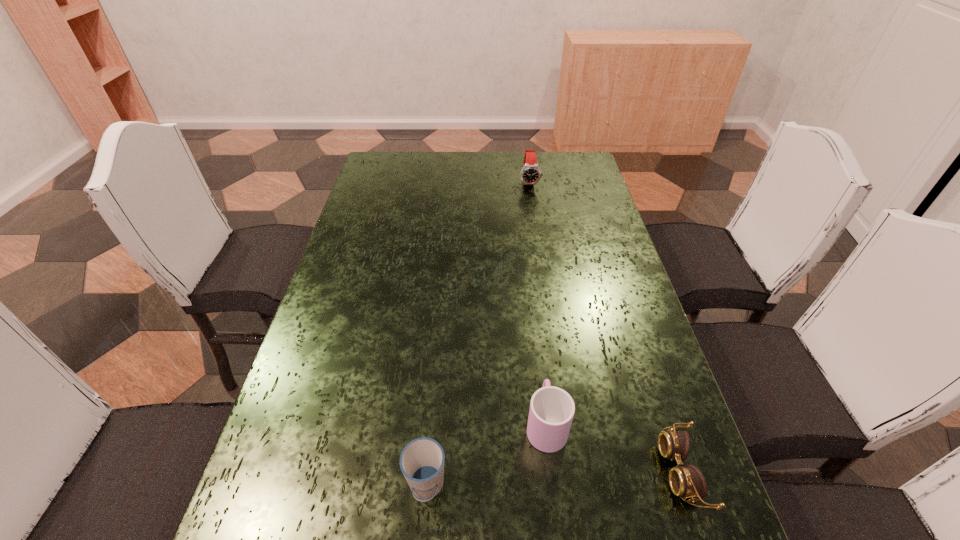
You are a GUI agent. You are given a task and a screenshot of the screen. Output one action in this format:
    pyautogui.click(x=<x>, y=<y>)
    Task: Click on the watch
    The image size is (960, 540).
    Given the screenshot: What is the action you would take?
    pyautogui.click(x=530, y=174)

I want to click on the farther cup, so point(552,409).

Find the location of a particular element. the left cup is located at coordinates (421, 461).

Image resolution: width=960 pixels, height=540 pixels. Find the location of `the leftmost object`. the leftmost object is located at coordinates (421, 461).

At what (x,y) coordinates should I click in order to perform the action: click on the rightmost object. Please return your answer as a coordinate pair (x, y). This screenshot has height=540, width=960. Looking at the image, I should click on (688, 481).

Find the location of a particular element. This screenshot has height=540, width=960. the shortest object is located at coordinates (688, 481).

Where is `vacant space located on the face of the watch`? The height and width of the screenshot is (540, 960). vacant space located on the face of the watch is located at coordinates (538, 237).

Find the location of a particular element. Image resolution: width=960 pixels, height=540 pixels. free location located with the handle on the side of the right cup is located at coordinates (538, 356).

Locate an element on the screen. vacant space located 0.260m with the handle on the side of the right cup is located at coordinates (533, 309).

The image size is (960, 540). I want to click on free region located with the handle on the side of the right cup, so click(x=536, y=340).